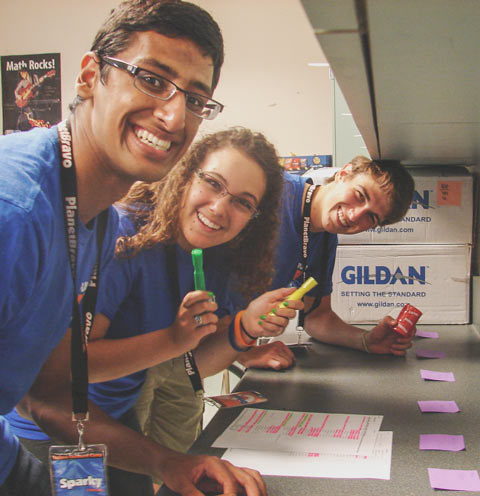
You are a GUI agent. You are given a task and a screenshot of the screen. Output one action in this format:
    pyautogui.click(x=<x>, y=<y>)
    Task: Click on the purple sticky note
    The image size is (480, 496).
    Given the screenshot: What is the action you would take?
    pyautogui.click(x=430, y=332), pyautogui.click(x=430, y=353), pyautogui.click(x=433, y=375), pyautogui.click(x=438, y=406), pyautogui.click(x=444, y=437), pyautogui.click(x=456, y=482)